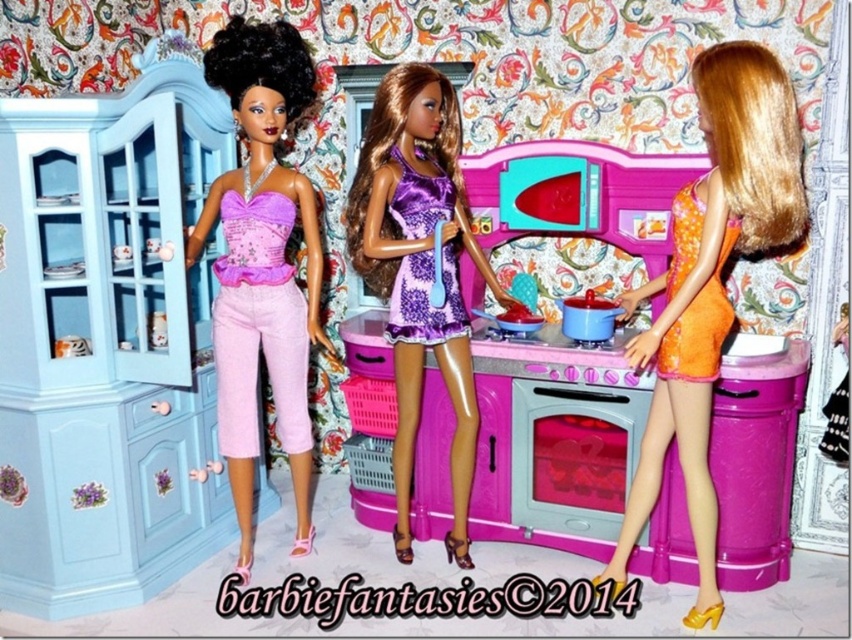
You are arranging dishes in the miniature kitchen. The scene shows a matte pink pot at center and a matte white plate at left. Which object is positioned to the right of the other?

The matte pink pot at center is to the right of the matte white plate at left.

You are a tiny chef in this miniature kitchen. You need to place a spice jar exactly halfway between point A at point (286, 65) and point B at point (588, 321). Which point is closer to the camera, point A or point B?

Point A at point (286, 65) is closer to the camera than point B at point (588, 321).

From the picture: You are setting up a miniature kitchen scene and need to place the matte pink pot at center and the matte white plate at left on a shelf. The shelf can only hold items where the pot is wider than the plate. Can you confirm if this arrangement is possible?

The matte pink pot at center has a larger width than the matte white plate at left, so the arrangement is possible as the pot is wider than the plate.